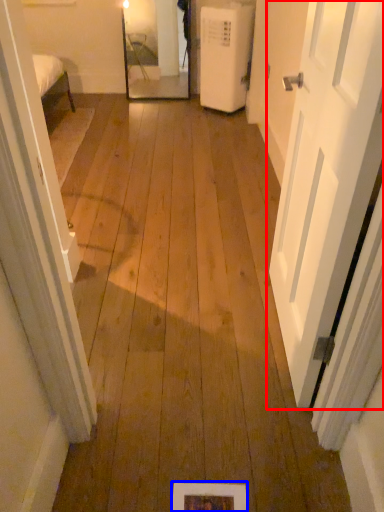
Question: Which object appears closest to the camera in this image, door (highlighted by a red box) or picture frame (highlighted by a blue box)?

Choices:
 (A) door
 (B) picture frame

Answer: (A)